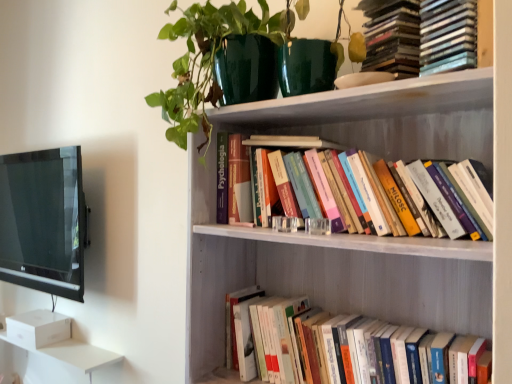
Question: From a real-world perspective, is hardcover books at upper right, placed as the first book when sorted from top to bottom, physically above black glossy tv at left?

Choices:
 (A) yes
 (B) no

Answer: (A)

Question: Considering the relative sizes of hardcover books at upper right, the third book in the bottom-to-top sequence, and black glossy tv at left in the image provided, is hardcover books at upper right, the third book in the bottom-to-top sequence, smaller than black glossy tv at left?

Choices:
 (A) no
 (B) yes

Answer: (B)

Question: Does hardcover books at upper right, placed as the first book when sorted from top to bottom, have a lesser height compared to black glossy tv at left?

Choices:
 (A) no
 (B) yes

Answer: (B)

Question: Considering the relative sizes of hardcover books at upper right, placed as the first book when sorted from top to bottom, and black glossy tv at left in the image provided, is hardcover books at upper right, placed as the first book when sorted from top to bottom, wider than black glossy tv at left?

Choices:
 (A) yes
 (B) no

Answer: (A)

Question: Is hardcover books at upper right, the third book in the bottom-to-top sequence, facing away from black glossy tv at left?

Choices:
 (A) yes
 (B) no

Answer: (B)

Question: Is hardcover books at upper right, placed as the first book when sorted from top to bottom, placed right next to black glossy tv at left?

Choices:
 (A) no
 (B) yes

Answer: (A)

Question: Is white wooden bookshelf at upper center facing away from green glossy pot at upper center?

Choices:
 (A) no
 (B) yes

Answer: (A)

Question: Considering the relative sizes of white wooden bookshelf at upper center and green glossy pot at upper center in the image provided, is white wooden bookshelf at upper center thinner than green glossy pot at upper center?

Choices:
 (A) yes
 (B) no

Answer: (B)

Question: Is white wooden bookshelf at upper center not close to green glossy pot at upper center?

Choices:
 (A) no
 (B) yes

Answer: (A)

Question: Is white wooden bookshelf at upper center to the left of green glossy pot at upper center from the viewer's perspective?

Choices:
 (A) no
 (B) yes

Answer: (A)

Question: Considering the relative sizes of white wooden bookshelf at upper center and green glossy pot at upper center in the image provided, is white wooden bookshelf at upper center bigger than green glossy pot at upper center?

Choices:
 (A) yes
 (B) no

Answer: (A)

Question: Is white wooden bookshelf at upper center further to camera compared to green glossy pot at upper center?

Choices:
 (A) yes
 (B) no

Answer: (B)

Question: From a real-world perspective, is hardcover books at lower right, which ranks as the 1th book in bottom-to-top order, on top of green glossy pot at upper center?

Choices:
 (A) no
 (B) yes

Answer: (A)